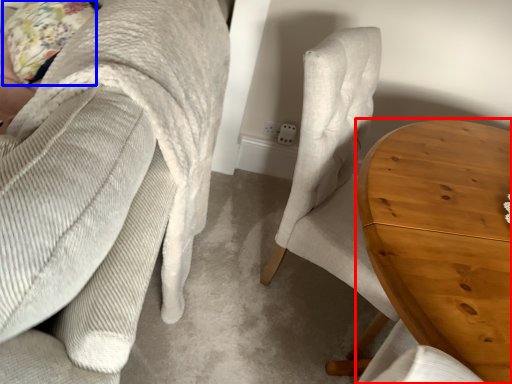
Question: Which of the following is the closest to the observer, table (highlighted by a red box) or pillow (highlighted by a blue box)?

Choices:
 (A) table
 (B) pillow

Answer: (A)